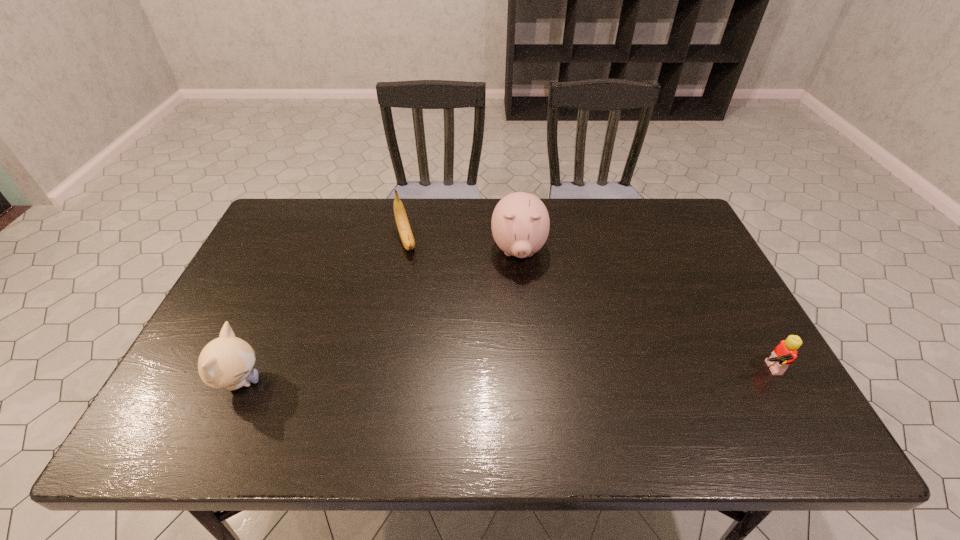
Locate an element on the screen. free spot between the third object from right to left and the piggy bank is located at coordinates (462, 246).

Where is `vacant area that lies between the piggy bank and the leftmost object`? The width and height of the screenshot is (960, 540). vacant area that lies between the piggy bank and the leftmost object is located at coordinates (379, 316).

This screenshot has height=540, width=960. What are the coordinates of `free spot between the banana and the kitten` in the screenshot? It's located at (323, 312).

The height and width of the screenshot is (540, 960). What are the coordinates of `free point between the Lego and the second object from left to right` in the screenshot? It's located at (586, 305).

This screenshot has width=960, height=540. In order to click on vacant space that is in between the leftmost object and the third object from left to right in this screenshot , I will do `click(379, 316)`.

At what (x,y) coordinates should I click in order to perform the action: click on the closest object to the second object from right to left. Please return your answer as a coordinate pair (x, y). The width and height of the screenshot is (960, 540). Looking at the image, I should click on [x=402, y=222].

Identify the location of object that stands as the second closest to the kitten. [520, 224].

Where is `free location that satisfies the following two spatial constraints: 1. on the front side of the banana; 2. on the left side of the third object from left to right`? free location that satisfies the following two spatial constraints: 1. on the front side of the banana; 2. on the left side of the third object from left to right is located at coordinates (404, 251).